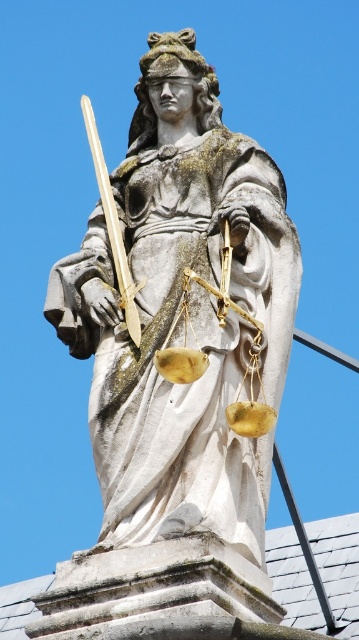
You are an art conservator assessing the statue of Lady Justice. You need to determine if the polished gold sword at upper center can be safely attached to the white stone statue at center without exceeding its height. Based on the scene description, can the sword be attached vertically on top of the statue?

The white stone statue at center is taller than the polished gold sword at upper center. Therefore, attaching the polished gold sword at upper center vertically on top of the white stone statue at center would not exceed the statue height, so it can be safely attached.

You are a tour guide explaining the layout of a historical park. You mention the white stone statue at center. Where is it located in the park?

The white stone statue at center is located at point (175, 308) in the park.

You are an art conservator examining the statue of Lady Justice. You notice the white stone statue at center and the polished gold sword at upper center. Which object is nearer to you when you stand directly in front of the statue?

The white stone statue at center is closer to the viewer than the polished gold sword at upper center, so the white stone statue at center is nearer to you when you stand directly in front of the statue.